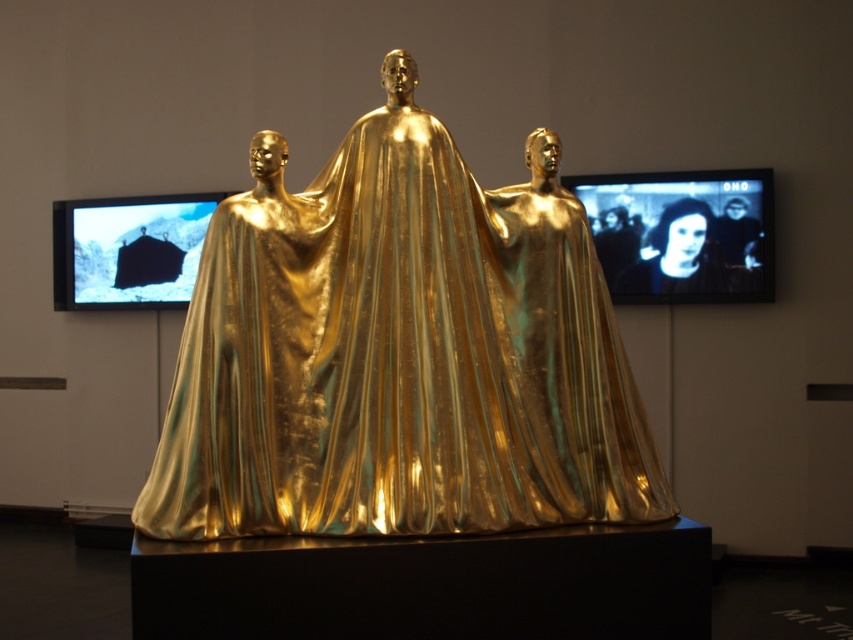
Question: Can you confirm if gold metallic cape at center is positioned above smooth black face at upper center?

Choices:
 (A) yes
 (B) no

Answer: (B)

Question: Which of the following is the closest to the observer?

Choices:
 (A) gold metallic cape at center
 (B) black glossy face at upper center
 (C) smooth black face at upper center

Answer: (A)

Question: Is black glossy face at upper center to the right of smooth black face at upper right from the viewer's perspective?

Choices:
 (A) no
 (B) yes

Answer: (A)

Question: Which point appears farthest from the camera in this image?

Choices:
 (A) (392, 170)
 (B) (699, 241)
 (C) (621, 205)
 (D) (753, 234)

Answer: (C)

Question: Can you confirm if smooth black face at upper center is positioned above smooth black face at upper right?

Choices:
 (A) yes
 (B) no

Answer: (B)

Question: Which point is farther from the camera taking this photo?

Choices:
 (A) (608, 252)
 (B) (732, 243)
 (C) (553, 237)

Answer: (A)